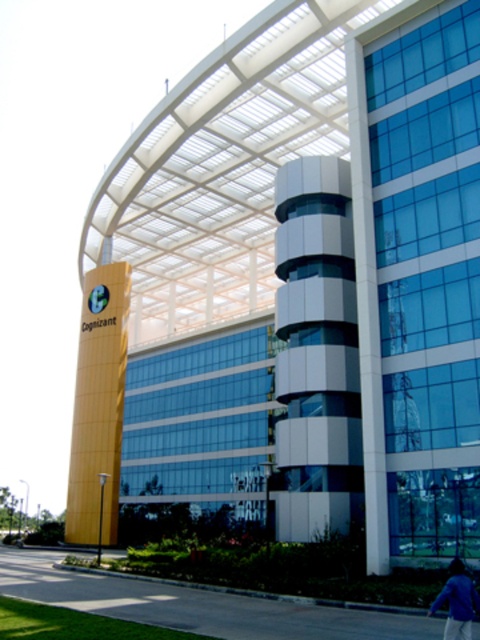
Which is more to the right, smooth asphalt pavement at lower center or blue fabric jacket at lower right?

blue fabric jacket at lower right is more to the right.

Does smooth asphalt pavement at lower center have a lesser width compared to blue fabric jacket at lower right?

In fact, smooth asphalt pavement at lower center might be wider than blue fabric jacket at lower right.

You are a GUI agent. You are given a task and a screenshot of the screen. Output one action in this format:
    pyautogui.click(x=<x>, y=<y>)
    Task: Click on the smooth asphalt pavement at lower center
    
    Given the screenshot: What is the action you would take?
    pyautogui.click(x=196, y=605)